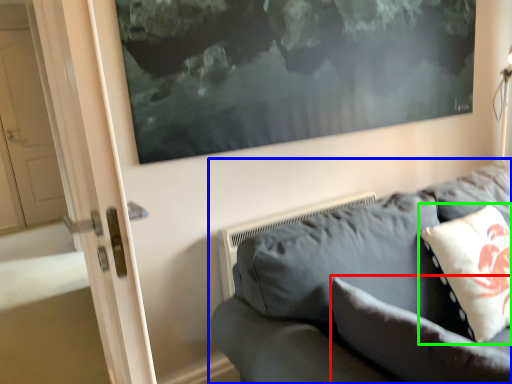
Question: Which object is positioned farthest from pillow (highlighted by a red box)? Select from studio couch (highlighted by a blue box) and pillow (highlighted by a green box).

Choices:
 (A) studio couch
 (B) pillow

Answer: (B)